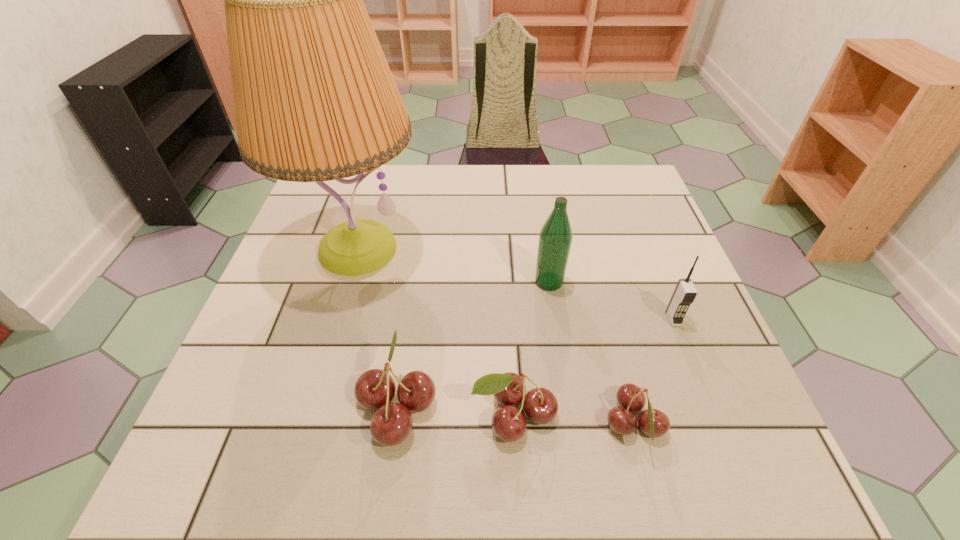
Considering the uniform spacing of cherrys, where should an additional cherry be positioned on the left? Please locate a free spot. Please provide its 2D coordinates. Your answer should be formatted as a tuple, i.e. [(x, y)], where the tuple contains the x and y coordinates of a point satisfying the conditions above.

[(284, 396)]